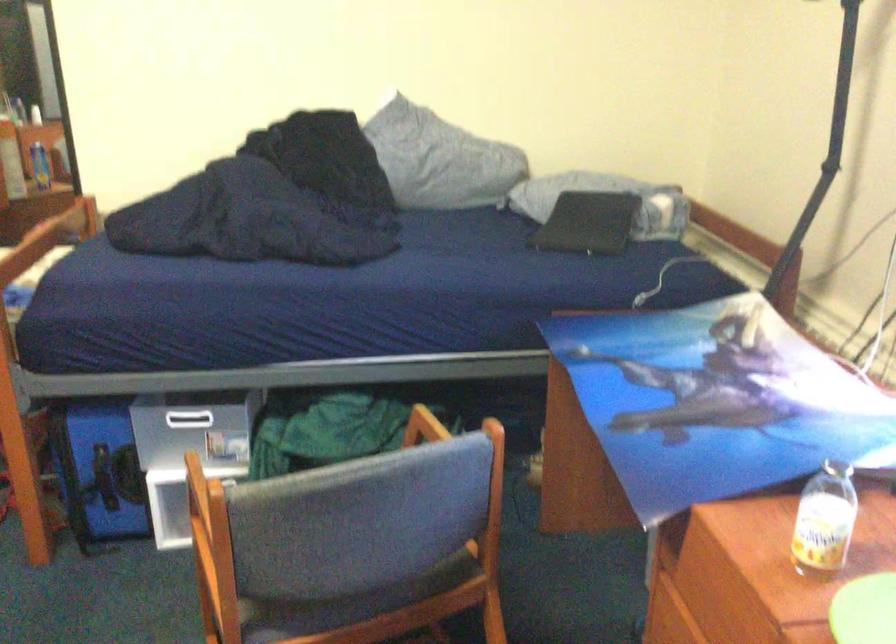
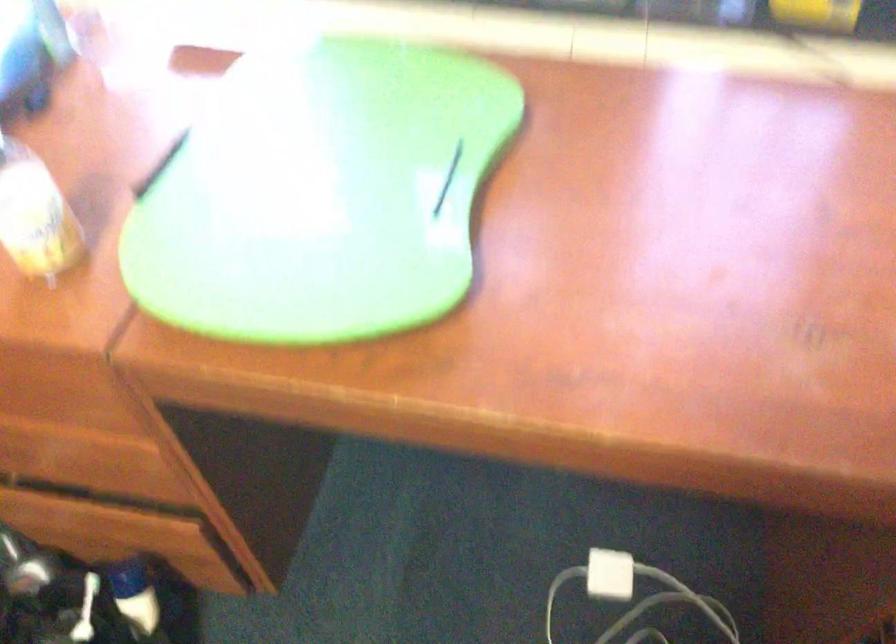
First-person continuous shooting, in which direction is the camera rotating?

The camera rotated toward right-down.